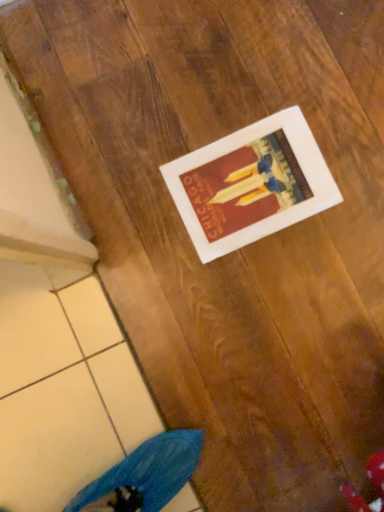
Find the location of `vacant area situated to the left side of white matte picture frame at center`. vacant area situated to the left side of white matte picture frame at center is located at coordinates (148, 251).